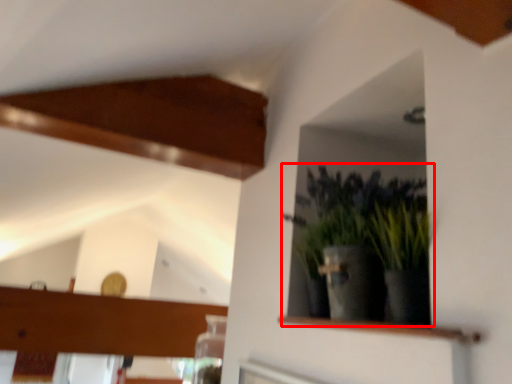
Question: From the image's perspective, where is houseplant (annotated by the red box) located in relation to shelf in the image?

Choices:
 (A) above
 (B) below

Answer: (A)